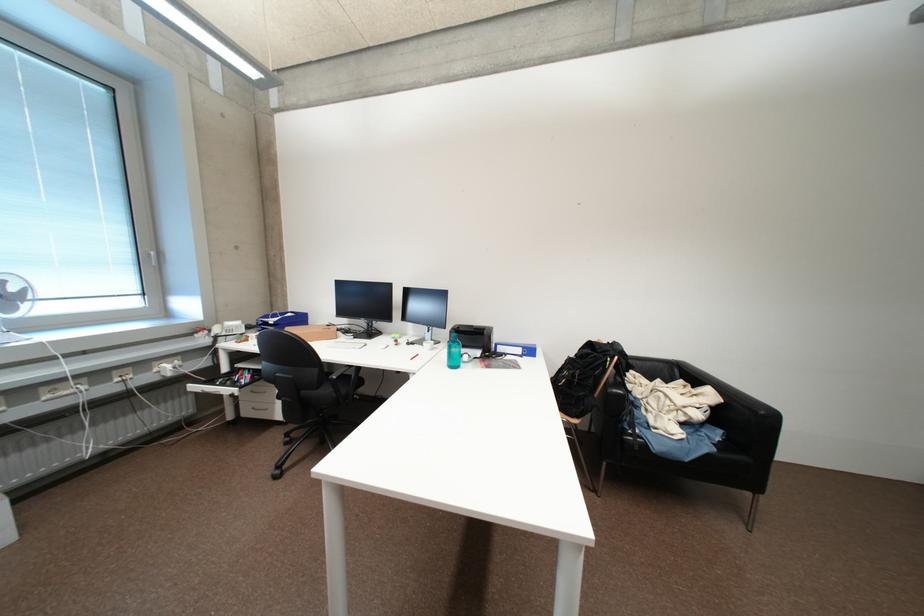
Locate an element on the screen. The image size is (924, 616). white window handle is located at coordinates (153, 257).